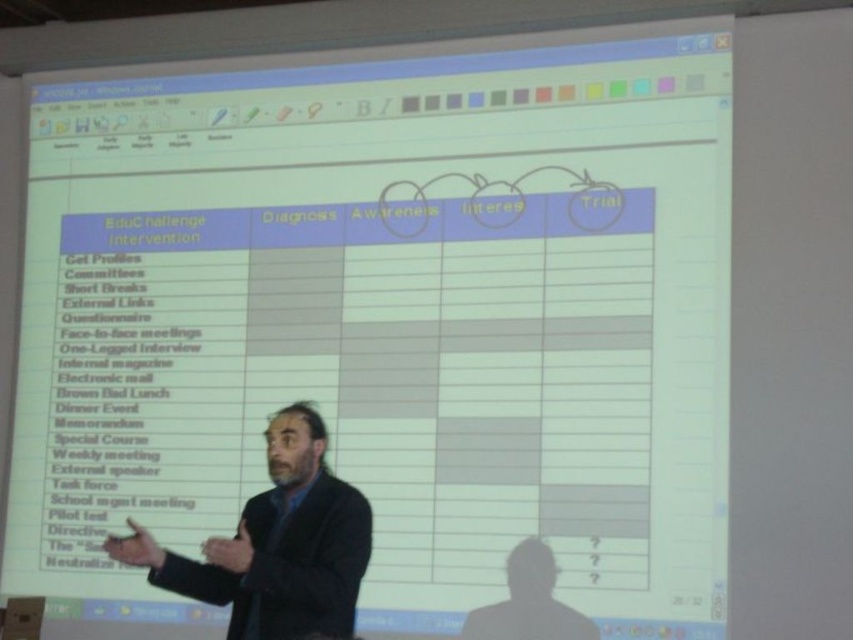
Question: Among these points, which one is farthest from the camera?

Choices:
 (A) (469, 624)
 (B) (270, 470)

Answer: (A)

Question: Is black suit at center positioned at the back of dark suit at center?

Choices:
 (A) no
 (B) yes

Answer: (A)

Question: Is the position of black suit at center more distant than that of dark suit at center?

Choices:
 (A) yes
 (B) no

Answer: (B)

Question: Can you confirm if black suit at center is positioned to the left of dark suit at center?

Choices:
 (A) yes
 (B) no

Answer: (A)

Question: Which point is closer to the camera taking this photo?

Choices:
 (A) (299, 584)
 (B) (561, 612)

Answer: (A)